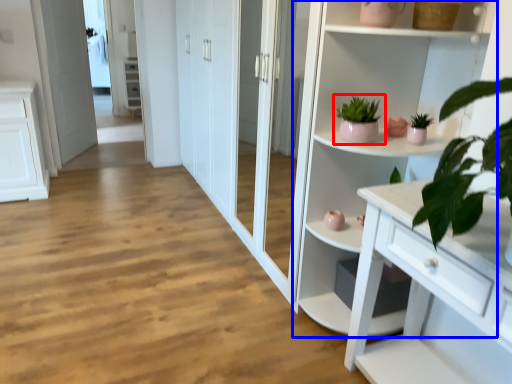
Question: Which point is further to the camera, houseplant (highlighted by a red box) or cupboard (highlighted by a blue box)?

Choices:
 (A) houseplant
 (B) cupboard

Answer: (A)